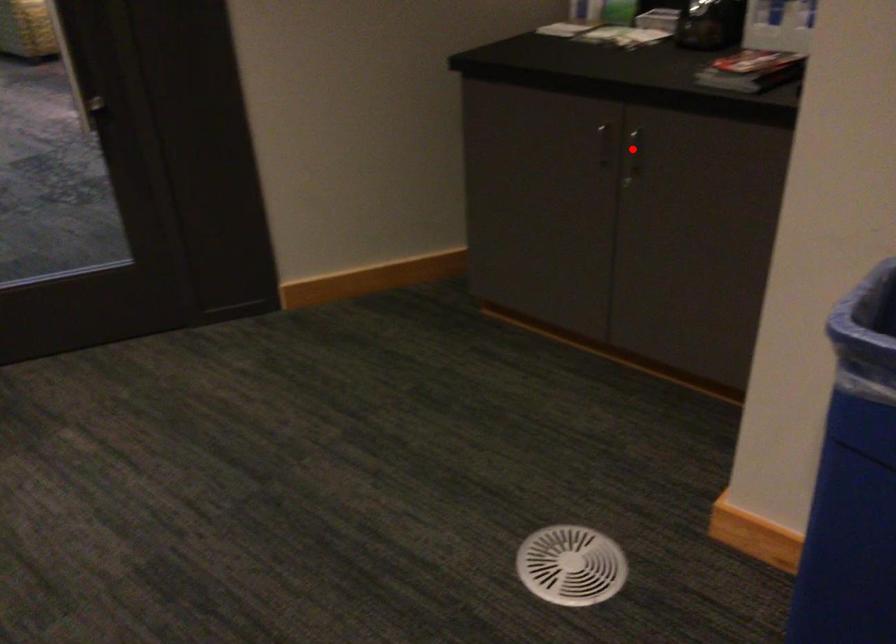
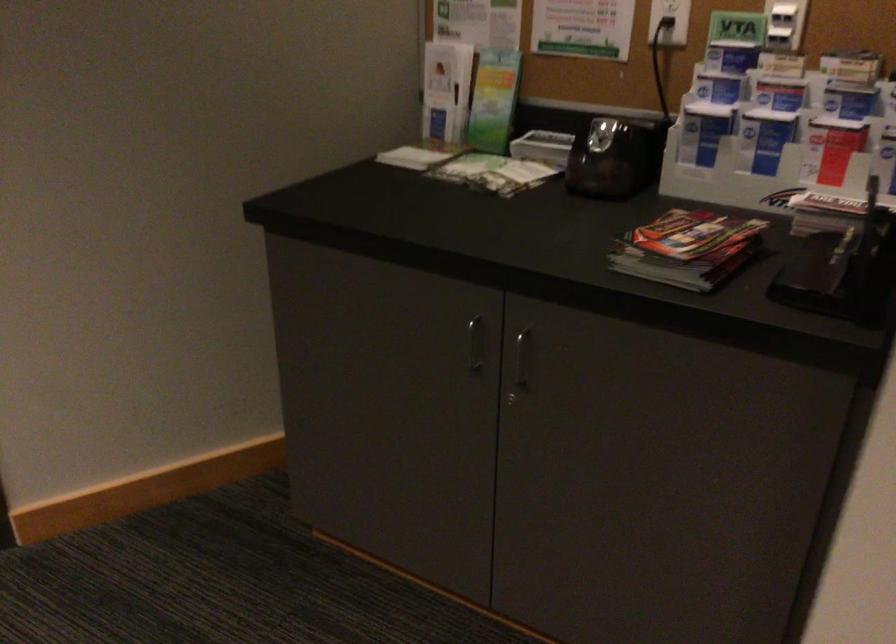
Question: I am providing you with two images of the same scene from different viewpoints. Given a red point in image1, look at the same physical point in image2. Is it:

Choices:
 (A) Closer to the viewpoint
 (B) Farther from the viewpoint

Answer: (A)